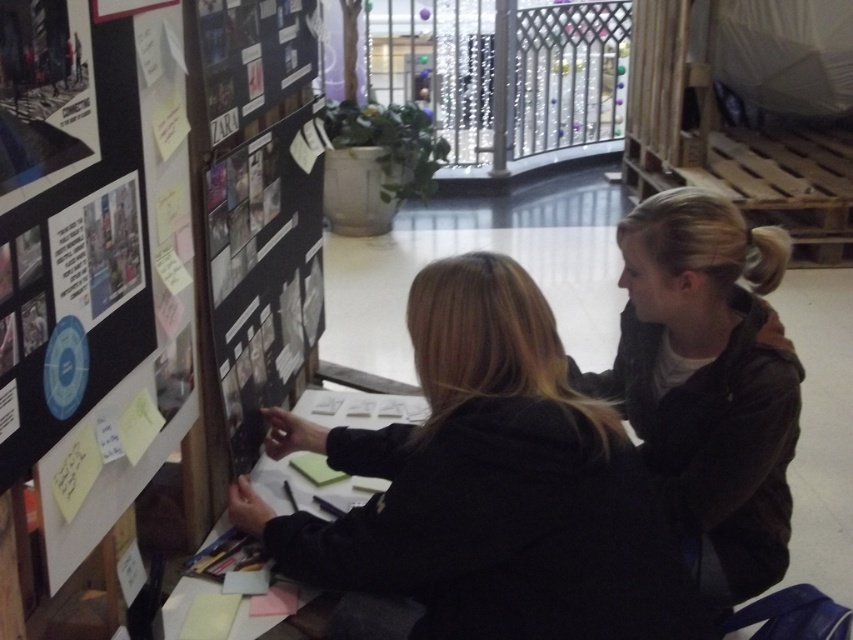
Describe the element at coordinates (708, 384) in the screenshot. I see `dark brown jacket at upper right` at that location.

Locate an element on the screen. The image size is (853, 640). dark brown jacket at upper right is located at coordinates (708, 384).

Where is `dark brown jacket at upper right`? Image resolution: width=853 pixels, height=640 pixels. dark brown jacket at upper right is located at coordinates (708, 384).

Does dark brown jacket at upper right have a greater height compared to matte black poster at upper left?

Indeed, dark brown jacket at upper right has a greater height compared to matte black poster at upper left.

Who is lower down, dark brown jacket at upper right or matte black poster at upper left?

dark brown jacket at upper right is below.

Is point (701, 372) positioned in front of point (32, 72)?

No, it is not.

I want to click on dark brown jacket at upper right, so click(708, 384).

Is black matte jacket at center smaller than black matte poster at center?

No.

Who is positioned more to the left, black matte jacket at center or black matte poster at center?

From the viewer's perspective, black matte poster at center appears more on the left side.

Is point (483, 604) in front of point (233, 244)?

Yes, point (483, 604) is in front of point (233, 244).

Find the location of `black matte jacket at center`. black matte jacket at center is located at coordinates (488, 484).